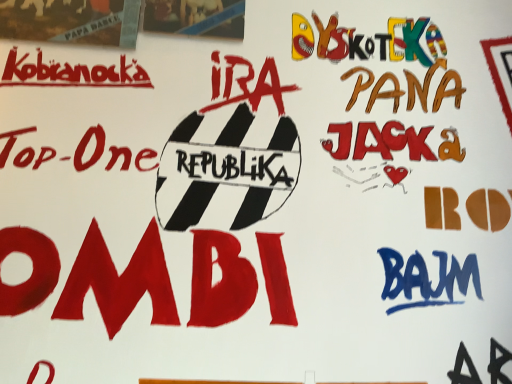
Question: Is point (77, 31) positioned closer to the camera than point (167, 1)?

Choices:
 (A) farther
 (B) closer

Answer: (B)

Question: From the image's perspective, is matte cardboard poster at upper left, the 1th poster when ordered from left to right, located above or below matte cardboard poster at upper left, acting as the 1th poster starting from the right?

Choices:
 (A) above
 (B) below

Answer: (B)

Question: Looking at the image, does matte cardboard poster at upper left, the second poster in the right-to-left sequence, seem bigger or smaller compared to matte cardboard poster at upper left, which is the second poster in left-to-right order?

Choices:
 (A) small
 (B) big

Answer: (B)

Question: From the image's perspective, relative to matte cardboard poster at upper left, the second poster in the right-to-left sequence, is matte cardboard poster at upper left, which is the second poster in left-to-right order, above or below?

Choices:
 (A) above
 (B) below

Answer: (A)

Question: Considering the positions of matte cardboard poster at upper left, acting as the 1th poster starting from the right, and matte cardboard poster at upper left, the 1th poster when ordered from left to right, in the image, is matte cardboard poster at upper left, acting as the 1th poster starting from the right, taller or shorter than matte cardboard poster at upper left, the 1th poster when ordered from left to right,?

Choices:
 (A) tall
 (B) short

Answer: (B)

Question: Does point (230, 11) appear closer or farther from the camera than point (59, 16)?

Choices:
 (A) farther
 (B) closer

Answer: (A)

Question: In the image, is matte cardboard poster at upper left, acting as the 1th poster starting from the right, on the left side or the right side of matte cardboard poster at upper left, the 1th poster when ordered from left to right?

Choices:
 (A) right
 (B) left

Answer: (A)